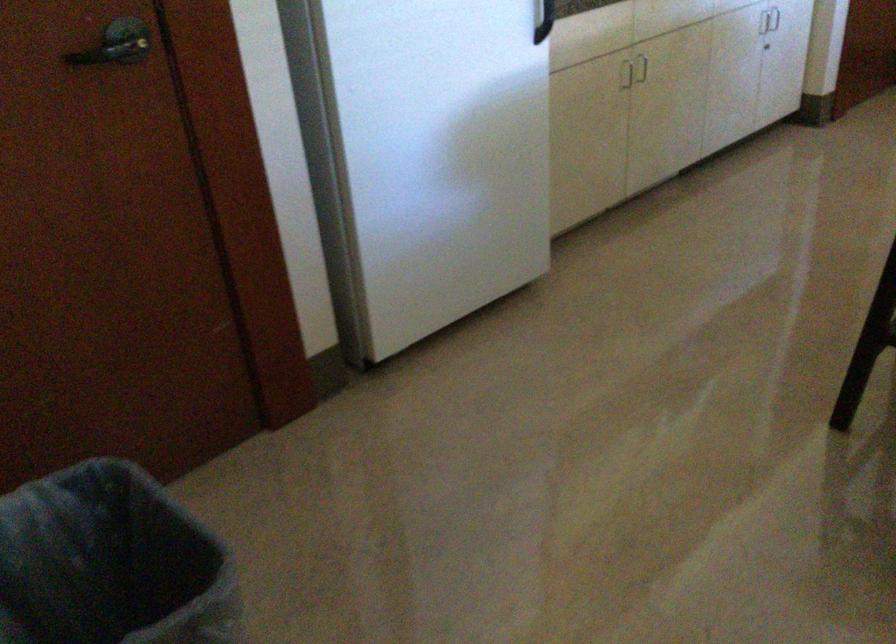
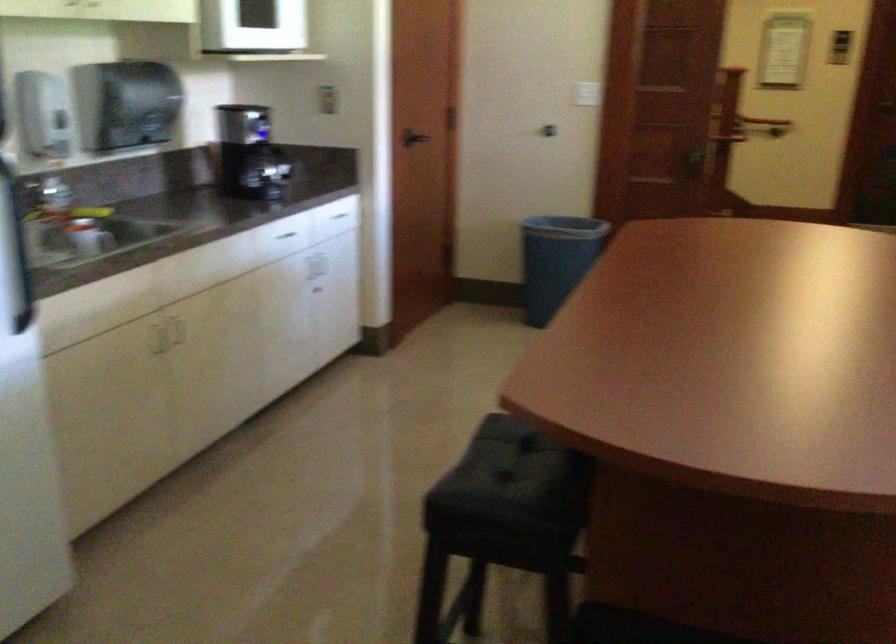
Question: Based on the continuous images, in which direction is the camera rotating? Reply with the corresponding letter.

Choices:
 (A) Left
 (B) Right
 (C) Up
 (D) Down

Answer: (B)